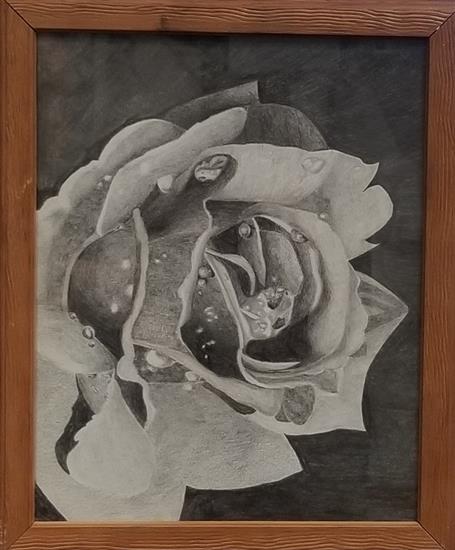
At what (x,y) coordinates should I click in order to perform the action: click on bottom of picture frame. Please return your answer as a coordinate pair (x, y). Looking at the image, I should click on (226, 536).